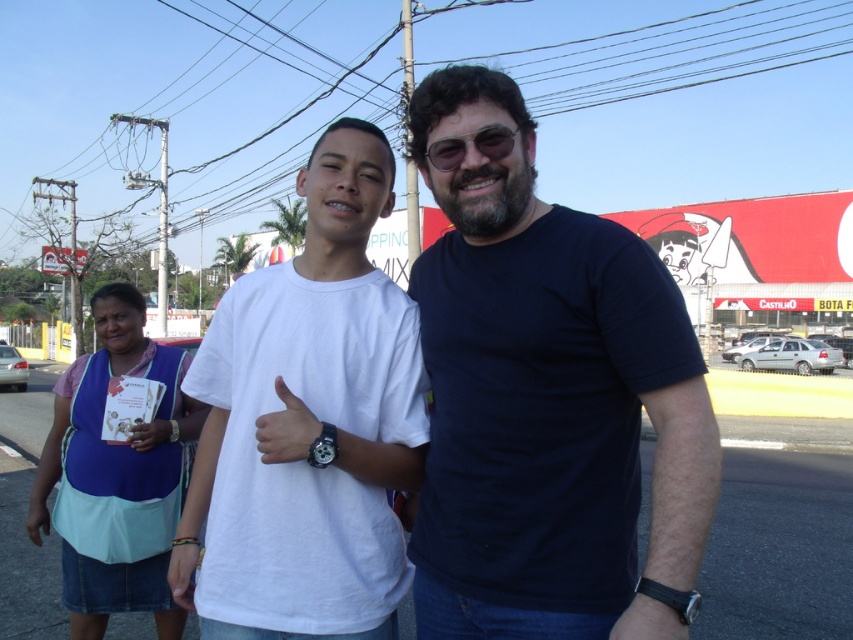
You are a photographer trying to capture a closeup of the black leather watch at lower right without including the white matte hand at center in the frame. Based on their positions, is this possible?

The white matte hand at center is above the black leather watch at lower right, so moving the camera angle slightly downward might allow you to focus on the black leather watch at lower right while avoiding the white matte hand at center.

You are a photographer trying to capture the white matte t shirt at center in the image. The camera you are using has a rectangular viewfinder. To ensure the t shirt is centered in your shot, where should you position the camera relative to the point marked at (316, 417)?

The white matte t shirt at center is located exactly at the point marked at (316, 417). To center it in the viewfinder, align the camera so that the crosshairs of the viewfinder are directly over this coordinate point.